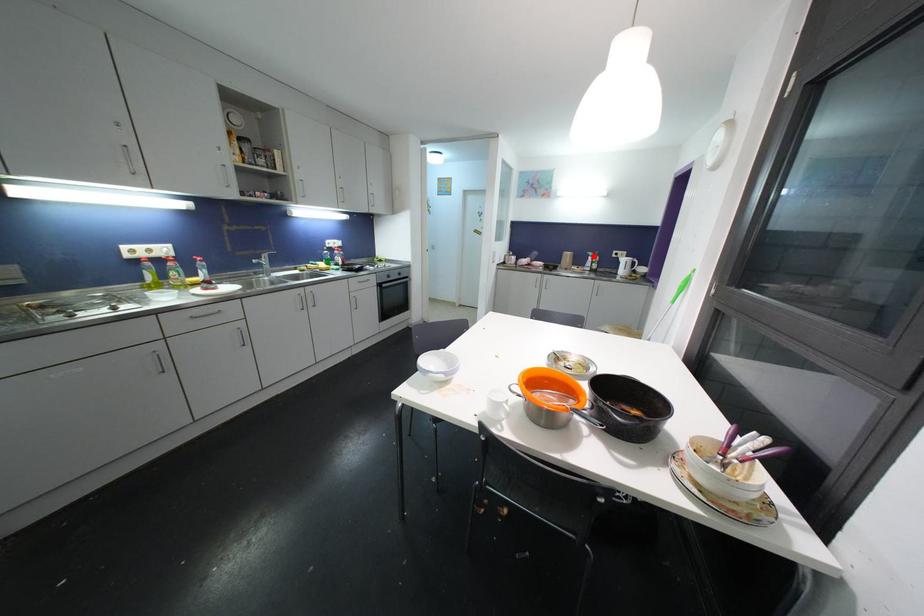
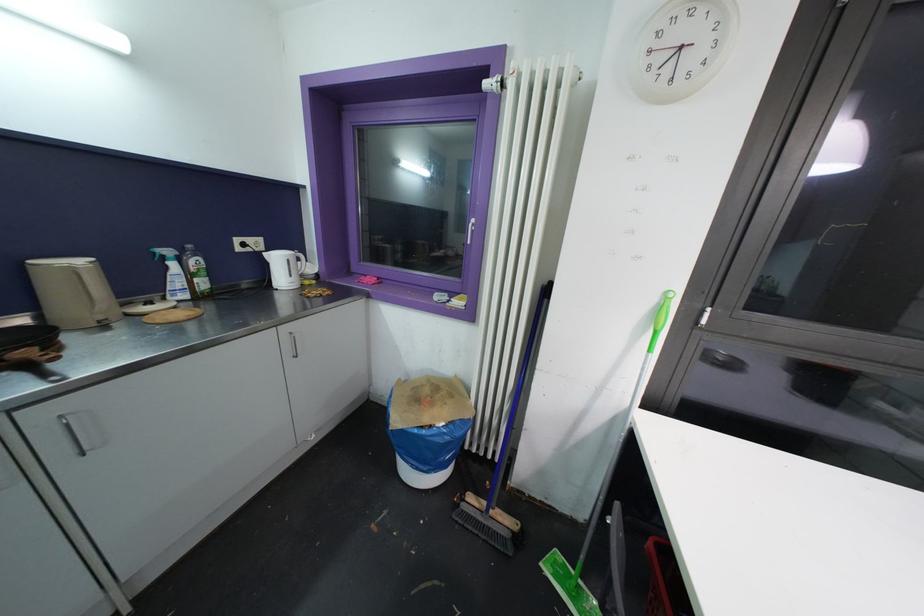
Question: I am providing you with two images of the same scene from different viewpoints. In image1, a red point is highlighted. Considering the same 3D point in image2, which of the following is correct?

Choices:
 (A) It is closer
 (B) It is farther

Answer: (B)